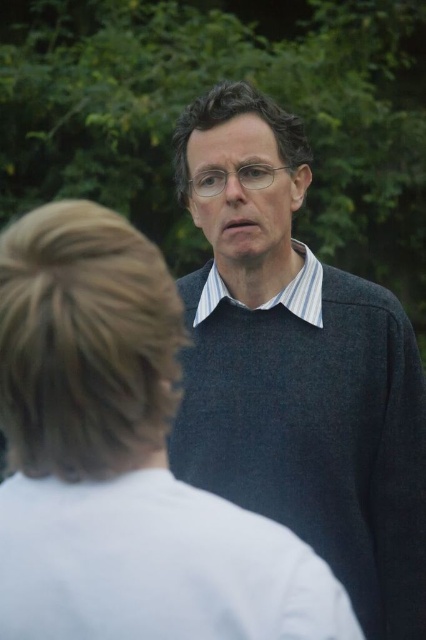
Question: Which of the following is the farthest from the observer?

Choices:
 (A) (316, 288)
 (B) (290, 316)

Answer: (A)

Question: Where is dark gray sweater at center located in relation to striped cotton shirt at center in the image?

Choices:
 (A) right
 (B) left

Answer: (A)

Question: Which of the following is the closest to the observer?

Choices:
 (A) (32, 632)
 (B) (204, 304)
 (C) (209, 344)

Answer: (A)

Question: Which point is farther to the camera?

Choices:
 (A) (420, 554)
 (B) (302, 268)
 (C) (98, 634)

Answer: (B)

Question: Is white matte shirt at center smaller than striped cotton shirt at center?

Choices:
 (A) yes
 (B) no

Answer: (B)

Question: In this image, where is white matte shirt at center located relative to dark gray sweater at center?

Choices:
 (A) right
 (B) left

Answer: (B)